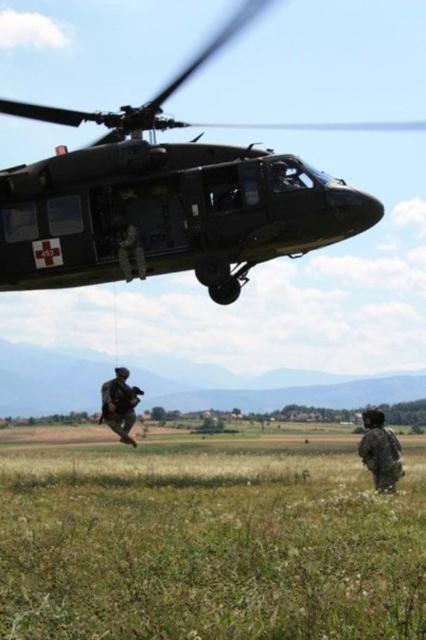
You are a military commander assessing the scene. Which soldier, the camouflage uniform at lower right or the camouflage uniform at center, is closer to the helicopter?

The camouflage uniform at center is closer to the helicopter because the camouflage uniform at lower right occupies less space, indicating it is farther away.

You are a military commander assessing the scene. You need to direct a new soldier to the location of the matte black helicopter at upper center. Based on the scene, where should the soldier move relative to the camouflage uniform at lower right?

The matte black helicopter at upper center is located to the left of the camouflage uniform at lower right. The soldier should move towards the left side relative to the camouflage uniform at lower right to reach the matte black helicopter at upper center.